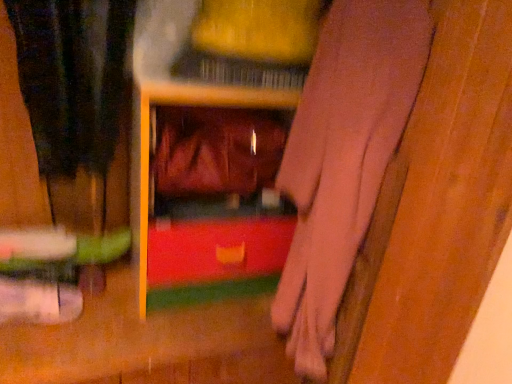
Image resolution: width=512 pixels, height=384 pixels. What are the coordinates of `matte plastic drawer at center` in the screenshot? It's located at (211, 193).

Describe the element at coordinates (211, 193) in the screenshot. This screenshot has height=384, width=512. I see `matte plastic drawer at center` at that location.

I want to click on matte plastic drawer at center, so click(x=211, y=193).